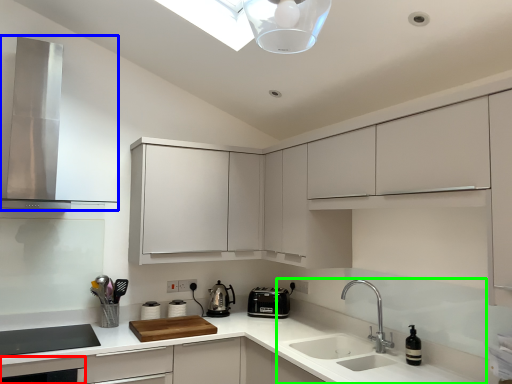
Question: Based on their relative distances, which object is farther from dish washer (highlighted by a red box)? Choose from home appliance (highlighted by a blue box) and sink (highlighted by a green box).

Choices:
 (A) home appliance
 (B) sink

Answer: (B)